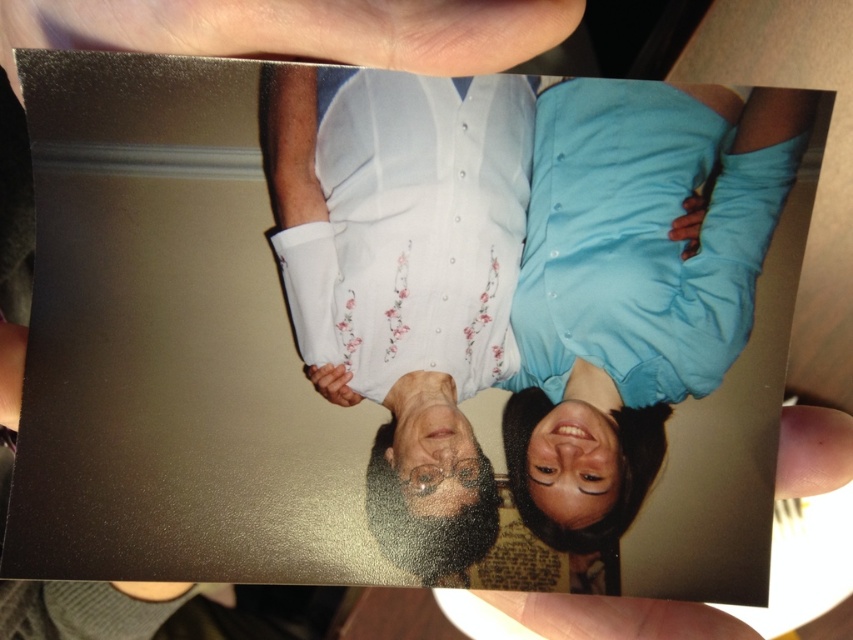
Question: Does white floral shirt at center appear on the right side of smooth skin hand at lower center?

Choices:
 (A) yes
 (B) no

Answer: (B)

Question: Which point appears farthest from the camera in this image?

Choices:
 (A) (543, 596)
 (B) (370, 13)

Answer: (A)

Question: Which object appears closest to the camera in this image?

Choices:
 (A) metallic silver hand at upper center
 (B) smooth skin hand at lower center
 (C) white floral shirt at center

Answer: (A)

Question: Which of the following is the farthest from the observer?

Choices:
 (A) (366, 90)
 (B) (369, 13)

Answer: (A)

Question: Can you confirm if metallic silver hand at upper center is positioned above smooth skin hand at lower center?

Choices:
 (A) no
 (B) yes

Answer: (B)

Question: Does white floral shirt at center come in front of metallic silver hand at upper center?

Choices:
 (A) no
 (B) yes

Answer: (A)